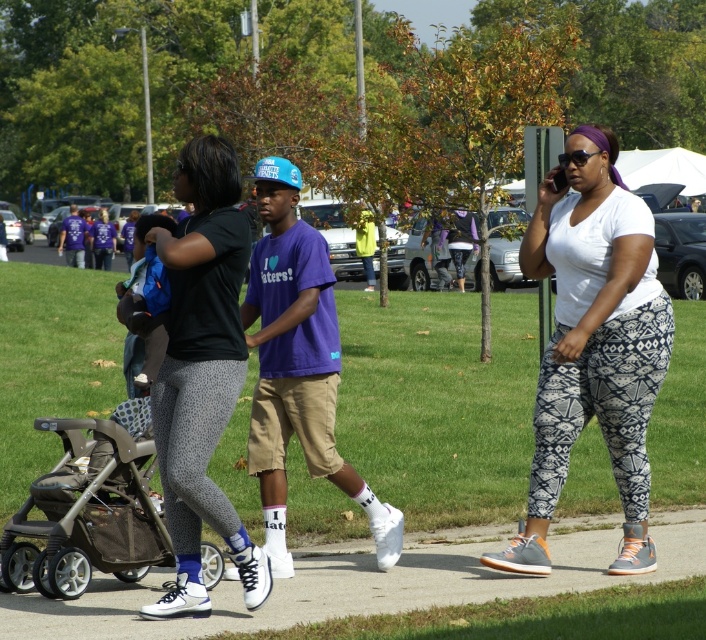
Is white printed leggings at center thinner than brown fabric stroller at lower left?

Yes.

In the scene shown: Which is more to the left, white printed leggings at center or brown fabric stroller at lower left?

Positioned to the left is brown fabric stroller at lower left.

At what (x,y) coordinates should I click in order to perform the action: click on white printed leggings at center. Please return your answer as a coordinate pair (x, y). Looking at the image, I should click on coord(592,342).

Locate an element on the screen. This screenshot has width=706, height=640. white printed leggings at center is located at coordinates (592, 342).

Is white concrete sidewalk at center closer to the viewer compared to brown fabric stroller at lower left?

Yes, white concrete sidewalk at center is closer to the viewer.

Can you confirm if white concrete sidewalk at center is positioned to the right of brown fabric stroller at lower left?

Indeed, white concrete sidewalk at center is positioned on the right side of brown fabric stroller at lower left.

Which is in front, point (424, 552) or point (56, 477)?

Point (56, 477) is more forward.

This screenshot has height=640, width=706. In order to click on white concrete sidewalk at center in this screenshot , I will do `click(369, 580)`.

Which is behind, point (174, 582) or point (73, 564)?

The point (73, 564) is behind.

Identify the location of matte black leggings at center. Image resolution: width=706 pixels, height=640 pixels. (203, 371).

Between point (172, 321) and point (54, 582), which one is positioned in front?

Point (172, 321)

Find the location of `matte black leggings at center`. matte black leggings at center is located at coordinates (203, 371).